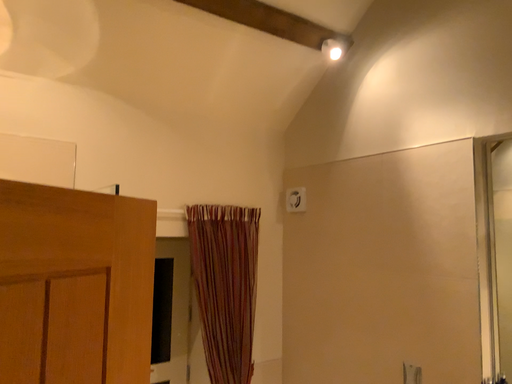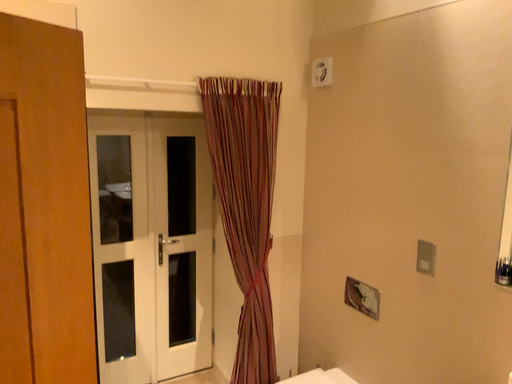
Question: Which way did the camera rotate in the video?

Choices:
 (A) rotated left
 (B) rotated right

Answer: (A)